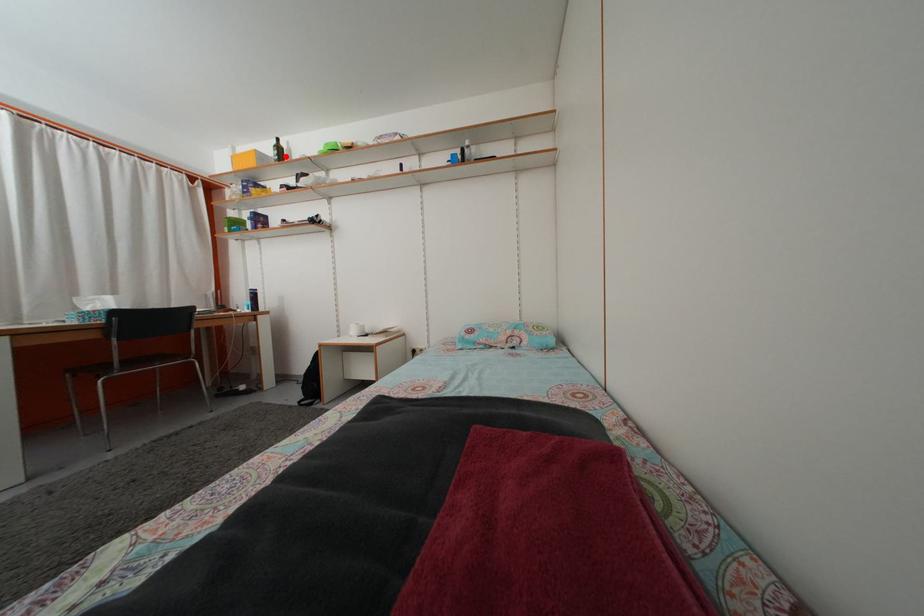
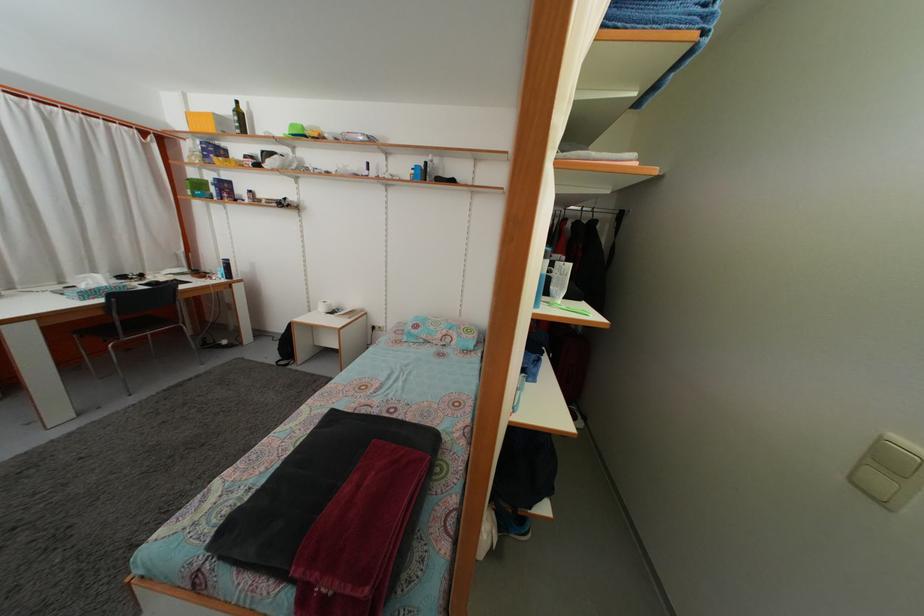
Question: A red point is marked in image1. In image2, is the corresponding 3D point closer to the camera or farther? Reply with the corresponding letter.

Choices:
 (A) The corresponding 3D point is closer.
 (B) The corresponding 3D point is farther.

Answer: (B)